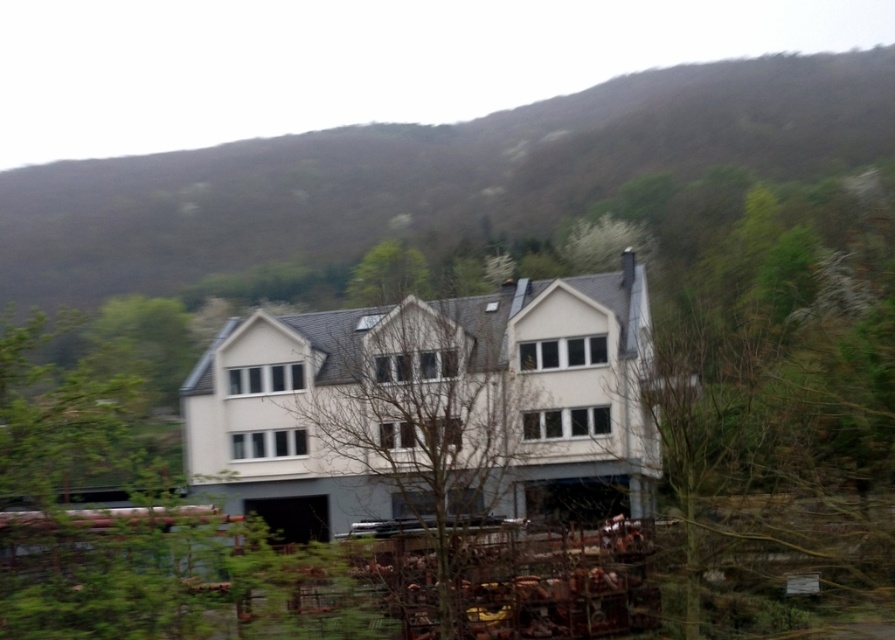
Question: Among these points, which one is farthest from the camera?

Choices:
 (A) (551, 371)
 (B) (538, 196)
 (C) (425, 474)

Answer: (B)

Question: Can you confirm if green forested mountain at upper center is smaller than bare branches at center?

Choices:
 (A) yes
 (B) no

Answer: (B)

Question: Can you confirm if green leafy tree at center is positioned above bare branches at center?

Choices:
 (A) no
 (B) yes

Answer: (B)

Question: Can you confirm if green forested mountain at upper center is positioned to the right of bare branches at center?

Choices:
 (A) yes
 (B) no

Answer: (B)

Question: Which object is farther from the camera taking this photo?

Choices:
 (A) green leafy tree at center
 (B) green forested mountain at upper center
 (C) bare branches at center

Answer: (B)

Question: Which object is farther from the camera taking this photo?

Choices:
 (A) bare branches at center
 (B) green forested mountain at upper center

Answer: (B)